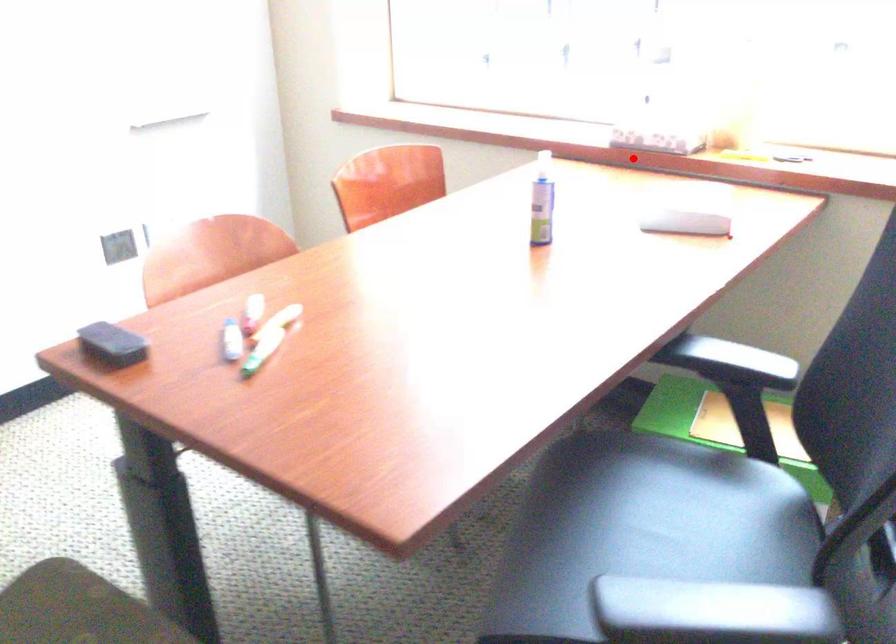
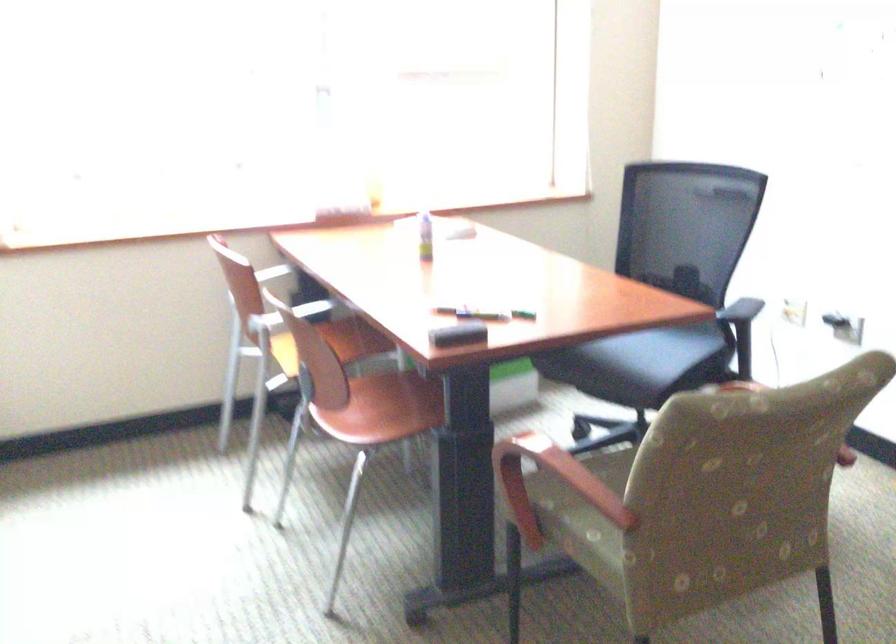
Question: I am providing you with two images of the same scene from different viewpoints. A red point is shown in image1. For the corresponding object point in image2, is it positioned nearer or farther from the camera?

Choices:
 (A) Nearer
 (B) Farther

Answer: (B)